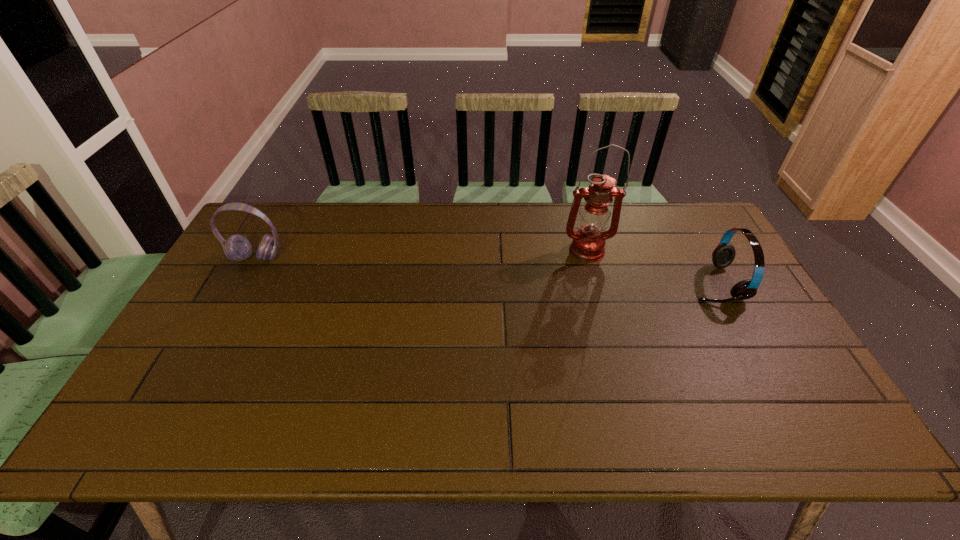
Point out which object is positioned as the nearest to the leftmost object. Please provide its 2D coordinates. Your answer should be formatted as a tuple, i.e. [(x, y)], where the tuple contains the x and y coordinates of a point satisfying the conditions above.

[(588, 243)]